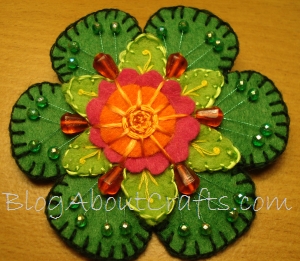
The width and height of the screenshot is (300, 261). I want to click on dark green felt, so pyautogui.click(x=212, y=215), pyautogui.click(x=42, y=130), pyautogui.click(x=92, y=222), pyautogui.click(x=93, y=40), pyautogui.click(x=193, y=33), pyautogui.click(x=256, y=118).